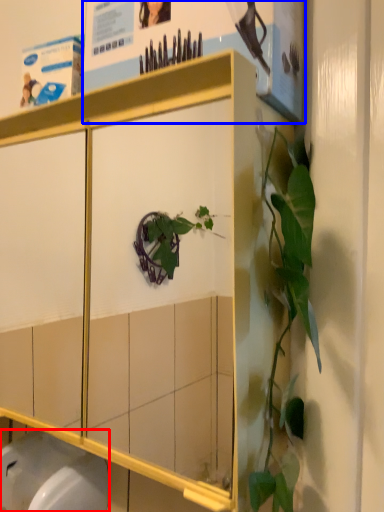
Question: Which point is closer to the camera, toilet bowl (highlighted by a red box) or poster page (highlighted by a blue box)?

Choices:
 (A) toilet bowl
 (B) poster page

Answer: (B)